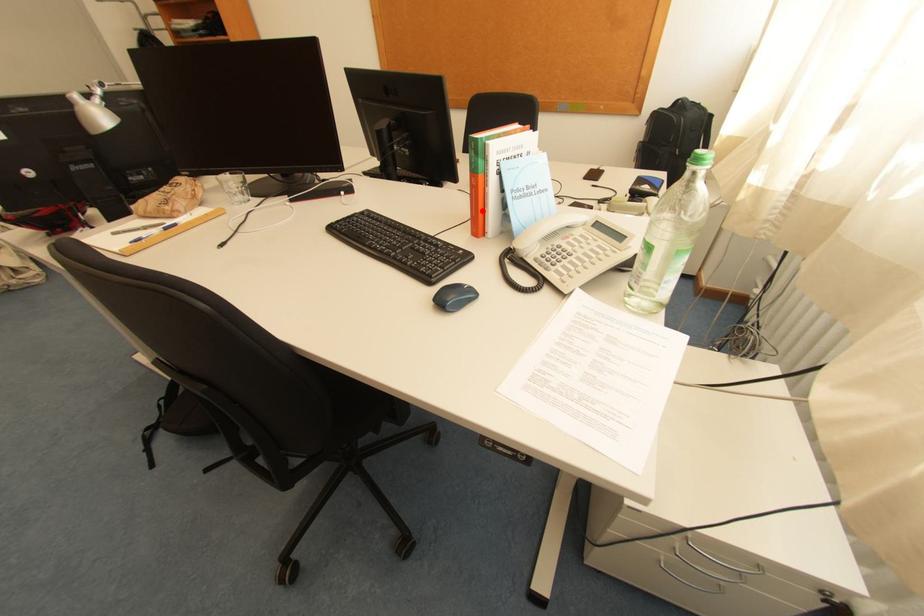
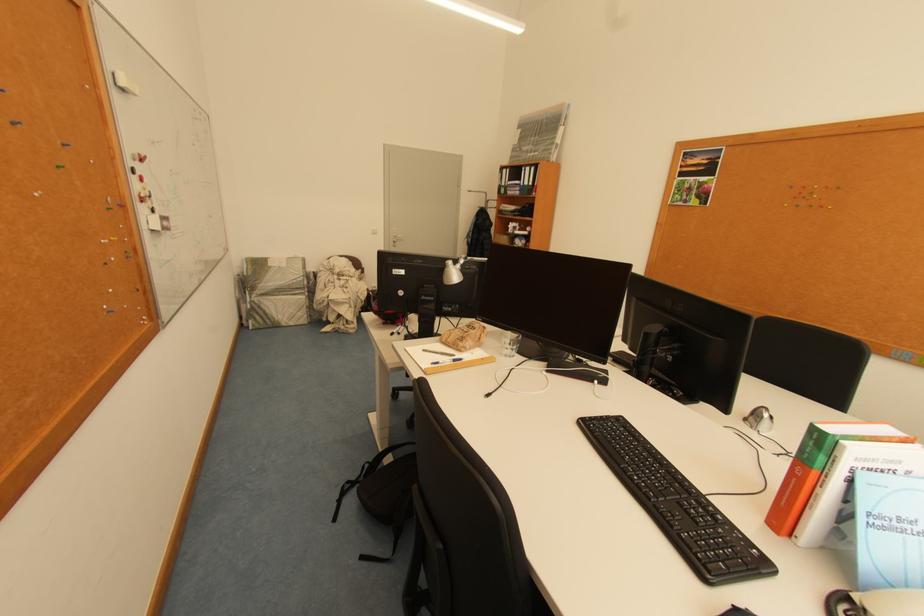
Find the pixel in the second image that matches the highlighted location in the first image.

(793, 501)